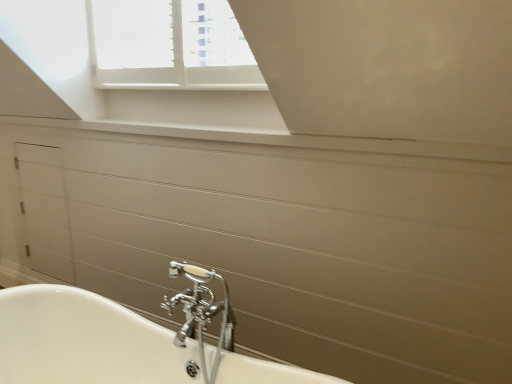
Question: Does chrome metallic faucet at lower center have a larger size compared to white glossy drawer at left?

Choices:
 (A) yes
 (B) no

Answer: (B)

Question: Could you tell me if chrome metallic faucet at lower center is facing white glossy drawer at left?

Choices:
 (A) no
 (B) yes

Answer: (A)

Question: Would you say white glossy drawer at left is part of chrome metallic faucet at lower center's contents?

Choices:
 (A) no
 (B) yes

Answer: (A)

Question: Is chrome metallic faucet at lower center outside white glossy drawer at left?

Choices:
 (A) yes
 (B) no

Answer: (A)

Question: Considering the relative positions of chrome metallic faucet at lower center and white glossy drawer at left in the image provided, is chrome metallic faucet at lower center to the left of white glossy drawer at left from the viewer's perspective?

Choices:
 (A) no
 (B) yes

Answer: (A)

Question: From a real-world perspective, is chrome metallic faucet at lower center positioned over white glossy drawer at left based on gravity?

Choices:
 (A) yes
 (B) no

Answer: (B)

Question: Is white glossy drawer at left thinner than chrome metallic faucet at lower center?

Choices:
 (A) yes
 (B) no

Answer: (A)

Question: Considering the relative sizes of white glossy drawer at left and chrome metallic faucet at lower center in the image provided, is white glossy drawer at left bigger than chrome metallic faucet at lower center?

Choices:
 (A) yes
 (B) no

Answer: (A)

Question: From a real-world perspective, does white glossy drawer at left stand above chrome metallic faucet at lower center?

Choices:
 (A) yes
 (B) no

Answer: (A)

Question: Considering the relative positions of white glossy drawer at left and chrome metallic faucet at lower center in the image provided, is white glossy drawer at left to the right of chrome metallic faucet at lower center from the viewer's perspective?

Choices:
 (A) yes
 (B) no

Answer: (B)

Question: From the image's perspective, would you say white glossy drawer at left is shown under chrome metallic faucet at lower center?

Choices:
 (A) no
 (B) yes

Answer: (A)

Question: Is white glossy drawer at left completely or partially outside of chrome metallic faucet at lower center?

Choices:
 (A) yes
 (B) no

Answer: (A)

Question: Is chrome metallic faucet at lower center wider or thinner than white glossy drawer at left?

Choices:
 (A) thin
 (B) wide

Answer: (B)